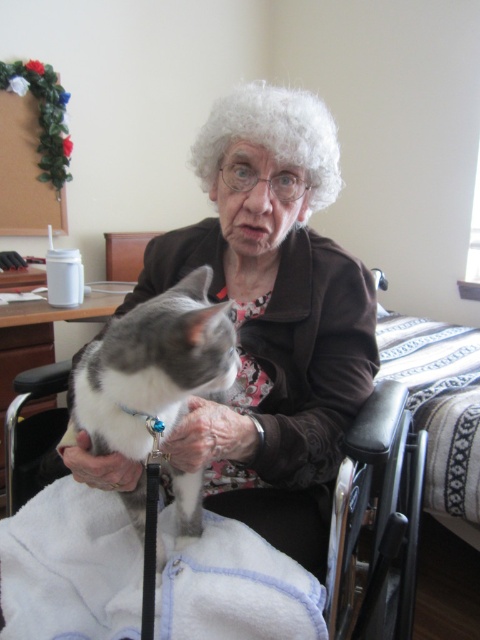
Can you confirm if matte brown jacket at center is positioned to the right of gray fur cat at center?

Indeed, matte brown jacket at center is positioned on the right side of gray fur cat at center.

Is matte brown jacket at center further to camera compared to gray fur cat at center?

Yes, matte brown jacket at center is further from the viewer.

What do you see at coordinates (273, 317) in the screenshot?
I see `matte brown jacket at center` at bounding box center [273, 317].

Identify the location of matte brown jacket at center. The width and height of the screenshot is (480, 640). (273, 317).

Does matte brown jacket at center appear under white curly wig at center?

Yes, matte brown jacket at center is below white curly wig at center.

Who is lower down, matte brown jacket at center or white curly wig at center?

matte brown jacket at center is below.

Between point (91, 477) and point (317, 106), which one is positioned in front?

Point (91, 477) is more forward.

The image size is (480, 640). What are the coordinates of `matte brown jacket at center` in the screenshot? It's located at (273, 317).

Is gray fur cat at center to the left of white curly wig at center from the viewer's perspective?

Correct, you'll find gray fur cat at center to the left of white curly wig at center.

Is gray fur cat at center to the right of white curly wig at center from the viewer's perspective?

No, gray fur cat at center is not to the right of white curly wig at center.

Measure the distance between gray fur cat at center and camera.

The distance of gray fur cat at center from camera is 23.36 inches.

Locate an element on the screen. The image size is (480, 640). gray fur cat at center is located at coordinates (153, 365).